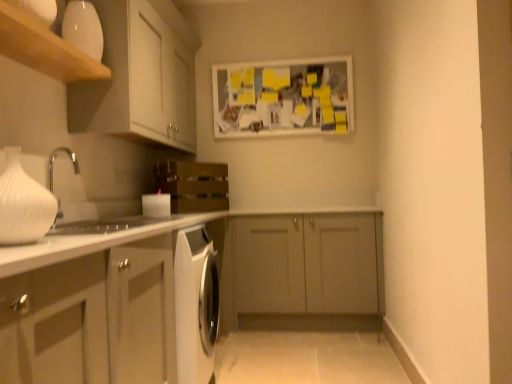
This screenshot has height=384, width=512. What are the coordinates of `empty space that is ontop of white matte bulletin board at upper center (from a real-world perspective)` in the screenshot? It's located at (278, 59).